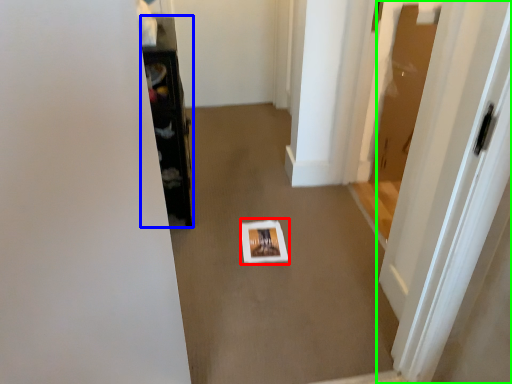
Question: Which is nearer to the square (highlighted by a red box)? furniture (highlighted by a blue box) or door (highlighted by a green box).

Choices:
 (A) furniture
 (B) door

Answer: (A)